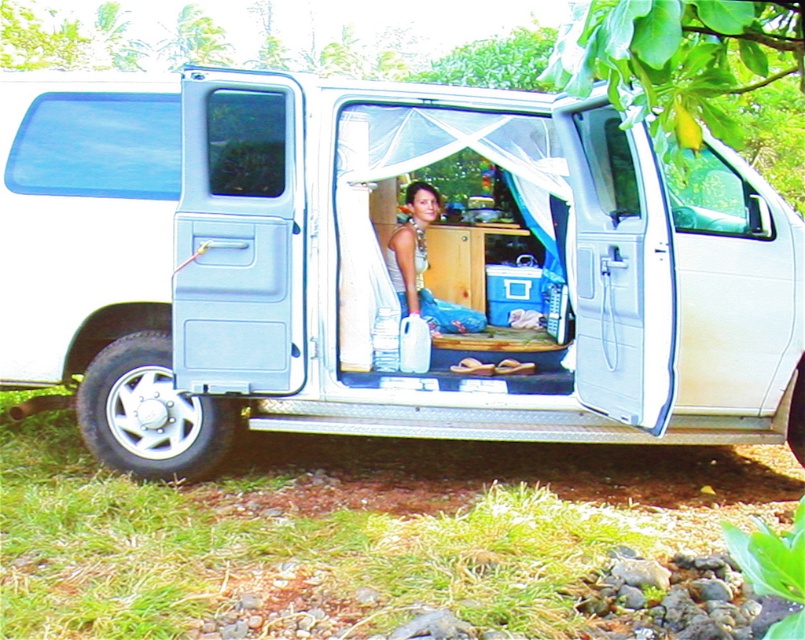
Question: Can you confirm if white matte van at center is thinner than matte white tank top at center?

Choices:
 (A) no
 (B) yes

Answer: (A)

Question: Is light blue plastic door at center above matte white tank top at center?

Choices:
 (A) yes
 (B) no

Answer: (A)

Question: Which object appears closest to the camera in this image?

Choices:
 (A) light blue plastic door at center
 (B) white matte van at center
 (C) white plastic door at right

Answer: (C)

Question: Which point is farther to the camera?

Choices:
 (A) (271, 115)
 (B) (229, 170)
 (C) (415, 211)

Answer: (C)

Question: Which point is farther to the camera?

Choices:
 (A) matte white tank top at center
 (B) light blue plastic door at center
 (C) white matte van at center
 (D) white plastic door at right

Answer: (A)

Question: Does white plastic door at right appear on the right side of matte white tank top at center?

Choices:
 (A) yes
 (B) no

Answer: (A)